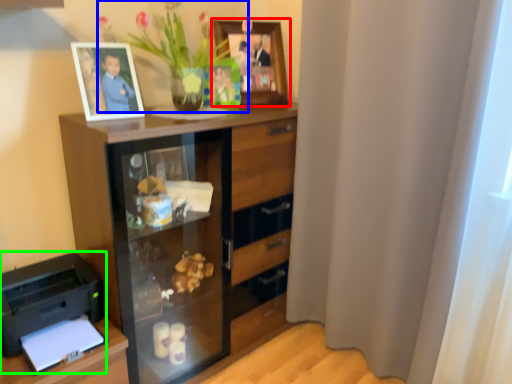
Question: Which object is the closest to the picture frame (highlighted by a red box)? Choose among these: floral arrangement (highlighted by a blue box) or printer (highlighted by a green box).

Choices:
 (A) floral arrangement
 (B) printer

Answer: (A)